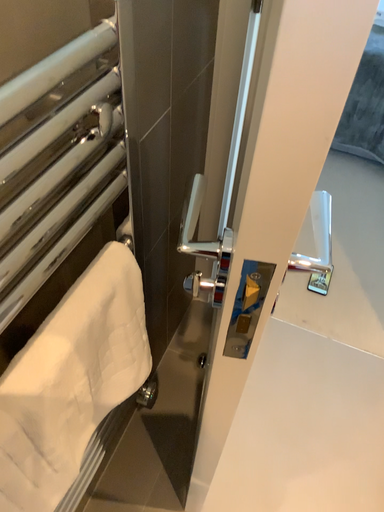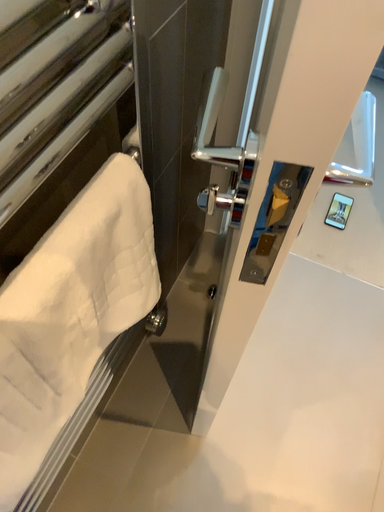
Question: Which way did the camera rotate in the video?

Choices:
 (A) rotated upward
 (B) rotated downward

Answer: (B)